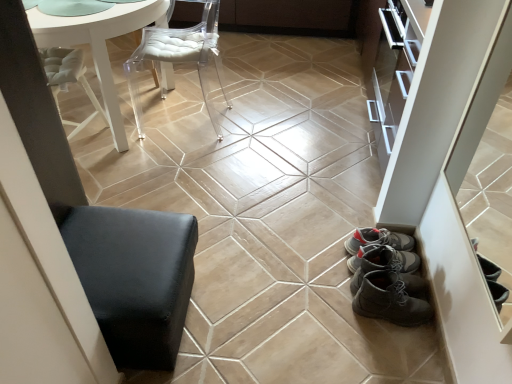
Question: From a real-world perspective, is beige glossy ceramic tile at center physically below black leather ottoman at lower left?

Choices:
 (A) yes
 (B) no

Answer: (A)

Question: Can you confirm if beige glossy ceramic tile at center is positioned to the left of black leather ottoman at lower left?

Choices:
 (A) yes
 (B) no

Answer: (B)

Question: From the image's perspective, is beige glossy ceramic tile at center over black leather ottoman at lower left?

Choices:
 (A) yes
 (B) no

Answer: (A)

Question: Is beige glossy ceramic tile at center wider than black leather ottoman at lower left?

Choices:
 (A) yes
 (B) no

Answer: (B)

Question: Is beige glossy ceramic tile at center further to camera compared to black leather ottoman at lower left?

Choices:
 (A) no
 (B) yes

Answer: (B)

Question: From the image's perspective, relative to transparent acrylic chair at upper center, is black leather ottoman at lower left above or below?

Choices:
 (A) above
 (B) below

Answer: (B)

Question: Is black leather ottoman at lower left to the left or to the right of transparent acrylic chair at upper center in the image?

Choices:
 (A) left
 (B) right

Answer: (A)

Question: Considering the positions of point (140, 332) and point (210, 119), is point (140, 332) closer or farther from the camera than point (210, 119)?

Choices:
 (A) closer
 (B) farther

Answer: (A)

Question: In terms of width, does black leather ottoman at lower left look wider or thinner when compared to transparent acrylic chair at upper center?

Choices:
 (A) wide
 (B) thin

Answer: (B)

Question: Would you say beige glossy ceramic tile at center is to the left or to the right of black leather ottoman at lower left in the picture?

Choices:
 (A) right
 (B) left

Answer: (A)

Question: Looking at the image, does beige glossy ceramic tile at center seem bigger or smaller compared to black leather ottoman at lower left?

Choices:
 (A) small
 (B) big

Answer: (A)

Question: Is beige glossy ceramic tile at center situated inside black leather ottoman at lower left or outside?

Choices:
 (A) inside
 (B) outside

Answer: (B)

Question: Is beige glossy ceramic tile at center in front of or behind black leather ottoman at lower left in the image?

Choices:
 (A) behind
 (B) front

Answer: (A)

Question: Would you say matte brown cabinet at upper center is inside or outside transparent acrylic chair at upper center?

Choices:
 (A) outside
 (B) inside

Answer: (A)

Question: In the image, is matte brown cabinet at upper center on the left side or the right side of transparent acrylic chair at upper center?

Choices:
 (A) left
 (B) right

Answer: (B)